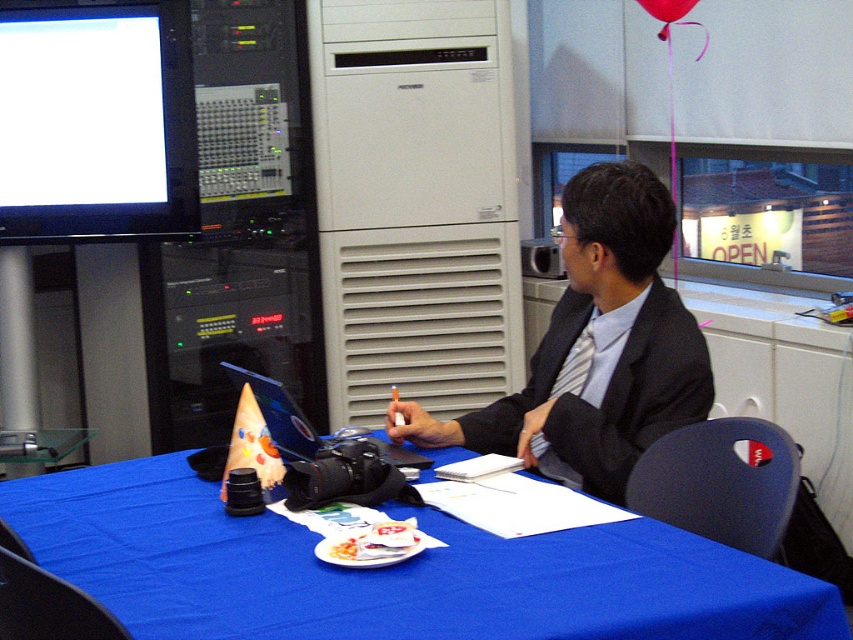
Does point (596, 474) come closer to viewer compared to point (314, 436)?

That is False.

Is matte black suit at center wider than blue plastic laptop at center?

Indeed, matte black suit at center has a greater width compared to blue plastic laptop at center.

What do you see at coordinates (639, 397) in the screenshot?
I see `matte black suit at center` at bounding box center [639, 397].

In order to click on matte black suit at center in this screenshot , I will do `click(639, 397)`.

From the picture: Between blue plastic laptop at center and red fabric balloon at upper center, which one is positioned higher?

red fabric balloon at upper center

Is blue plastic laptop at center closer to camera compared to red fabric balloon at upper center?

Yes, it is in front of red fabric balloon at upper center.

Is point (300, 413) closer to viewer compared to point (692, 4)?

Yes, it is.

Where is `blue plastic laptop at center`? blue plastic laptop at center is located at coordinates (305, 422).

Who is more forward, (634, 420) or (648, 10)?

Point (634, 420) is more forward.

Is matte black suit at center wider than red fabric balloon at upper center?

Yes.

Between point (525, 394) and point (666, 12), which one is positioned in front?

Point (525, 394) is in front.

At what (x,y) coordinates should I click in order to perform the action: click on matte black suit at center. Please return your answer as a coordinate pair (x, y). The height and width of the screenshot is (640, 853). Looking at the image, I should click on (639, 397).